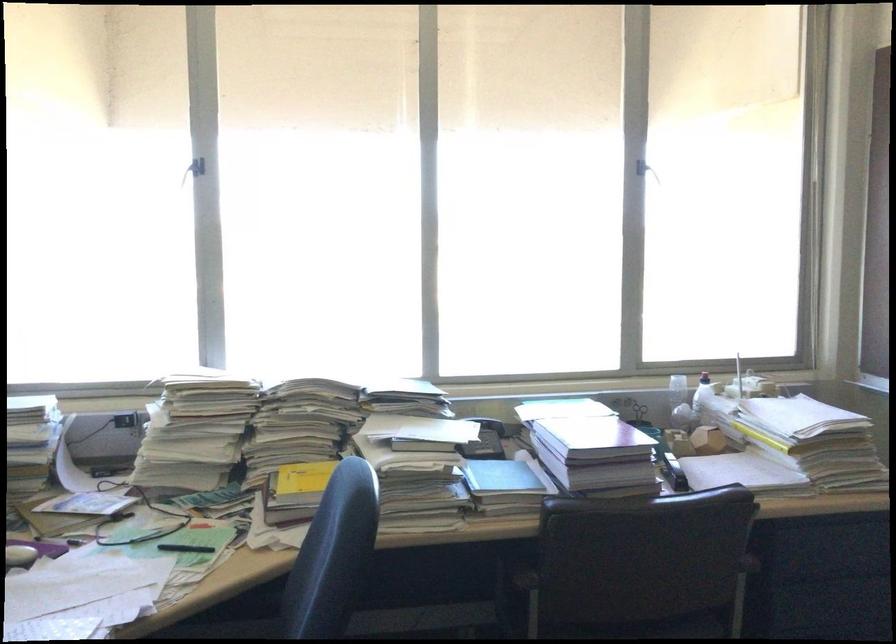
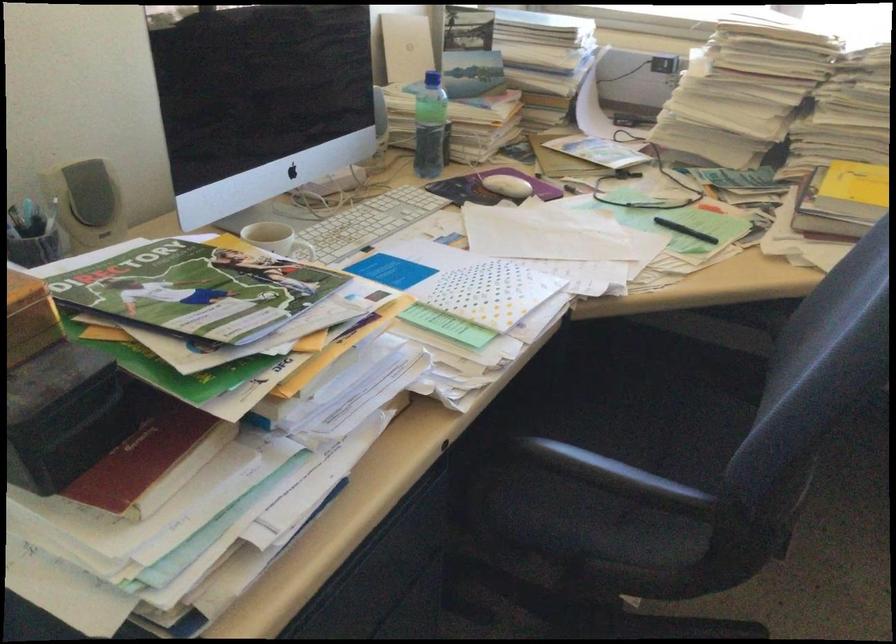
Question: I am providing you with two images of the same scene from different viewpoints. Which of the following objects are not visible in image2?

Choices:
 (A) green water bottle
 (B) white mug handle
 (C) black chair armrest
 (D) none of these

Answer: (D)